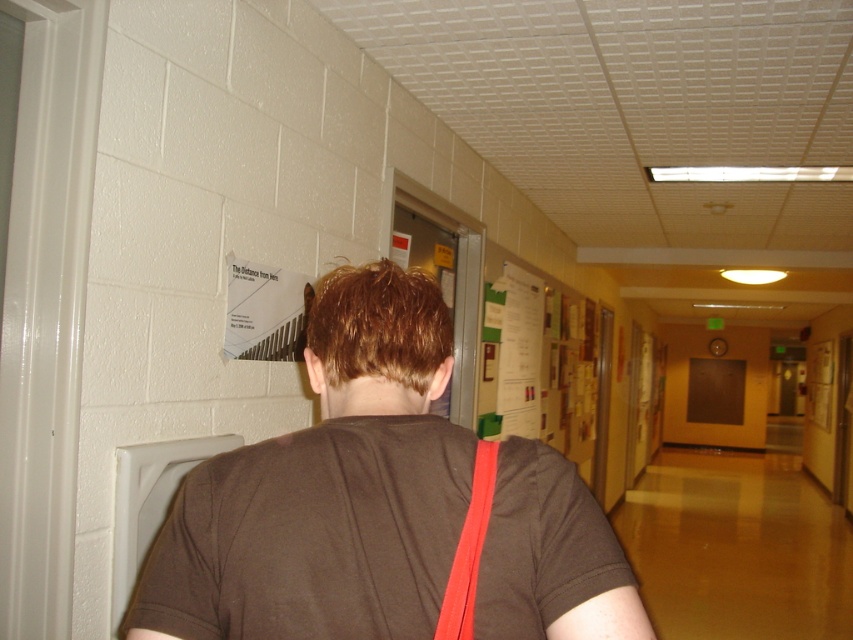
Is brown cotton shirt at center thinner than neon pink fabric strap at back?

In fact, brown cotton shirt at center might be wider than neon pink fabric strap at back.

Is brown cotton shirt at center to the right of neon pink fabric strap at back from the viewer's perspective?

In fact, brown cotton shirt at center is to the left of neon pink fabric strap at back.

Is point (608, 544) farther from camera compared to point (489, 467)?

No.

This screenshot has height=640, width=853. In order to click on brown cotton shirt at center in this screenshot , I will do `click(328, 488)`.